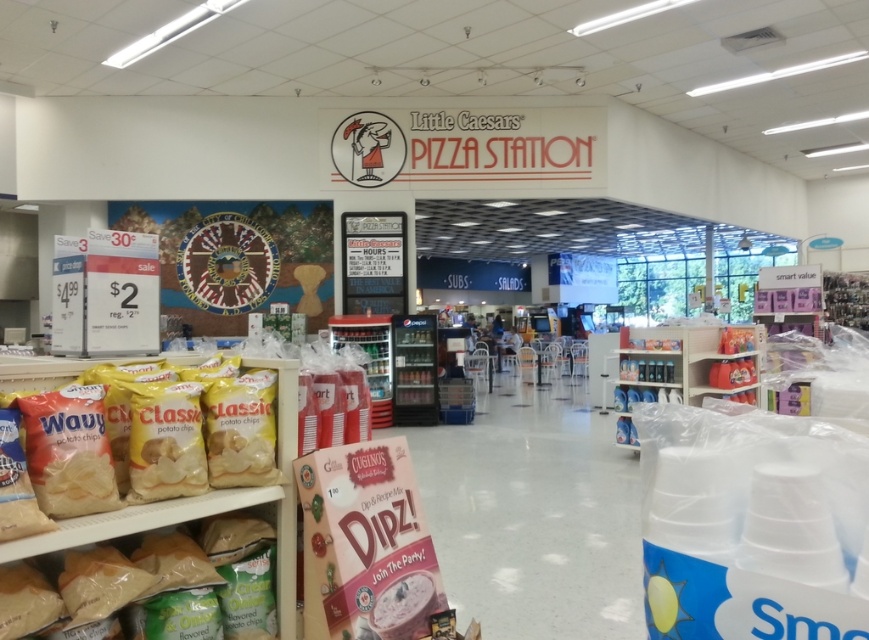
Question: Which of the following is the farthest from the observer?

Choices:
 (A) (221, 525)
 (B) (62, 536)

Answer: (A)

Question: Can you confirm if translucent plastic bag of chips at lower left is thinner than yellow matte potato chips at left?

Choices:
 (A) yes
 (B) no

Answer: (B)

Question: Where is translucent plastic bag of chips at lower left located in relation to yellow matte potato chips at left in the image?

Choices:
 (A) below
 (B) above

Answer: (A)

Question: Does translucent plastic bag of chips at lower left come in front of yellow matte potato chips at left?

Choices:
 (A) yes
 (B) no

Answer: (B)

Question: Which of the following is the closest to the observer?

Choices:
 (A) (242, 536)
 (B) (30, 365)

Answer: (B)